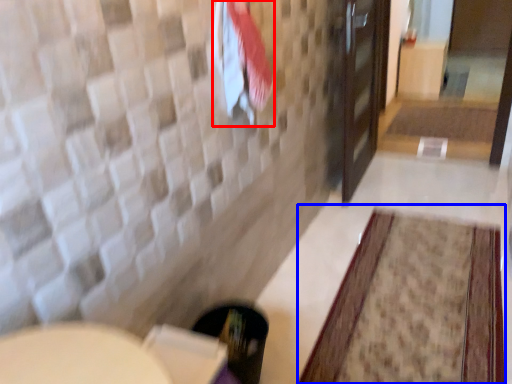
Question: Which of the following is the farthest to the observer, beach towel (highlighted by a red box) or bath mat (highlighted by a blue box)?

Choices:
 (A) beach towel
 (B) bath mat

Answer: (B)